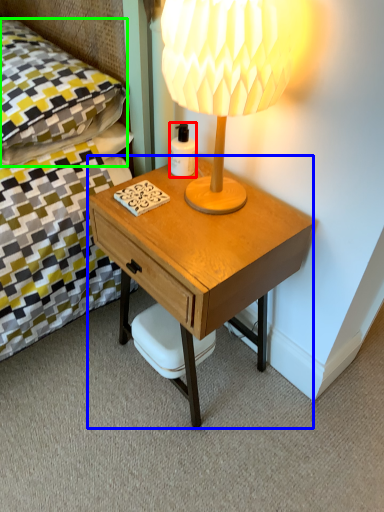
Question: Considering the real-world distances, which object is closest to bottle (highlighted by a red box)? desk (highlighted by a blue box) or pillow (highlighted by a green box).

Choices:
 (A) desk
 (B) pillow

Answer: (A)